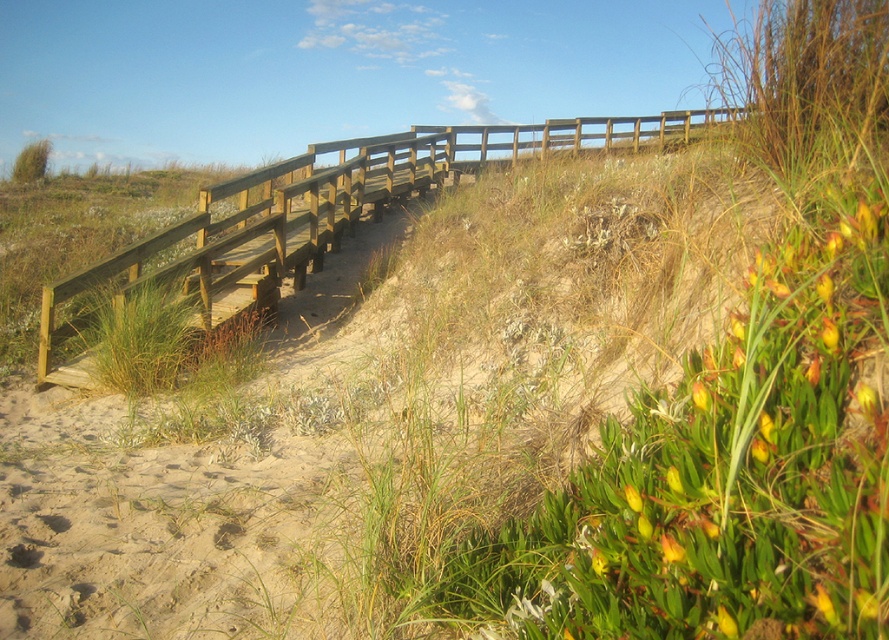
You are a hiker walking along the wooden rail at upper center and want to take a photo of the yellow matte flower at lower right. Is the flower visible through the rail?

The yellow matte flower at lower right is behind the wooden rail at upper center, so it might be obstructed by the rail and not fully visible.

From the picture: You are a photographer carrying a 1.2 meter wide camera setup. You need to position your equipment between the wooden rail at upper center and the yellow matte flower at lower right. Given their sizes, can you fit your setup without overlapping either object?

The wooden rail at upper center is larger in size than the yellow matte flower at lower right. Since the camera setup is 1.2 meters wide, you need to ensure there is enough space between them. However, without knowing the exact distance between the two objects, it is impossible to determine if the setup will fit without overlapping. Please check the actual spacing between the wooden rail at upper center and the yellow matte flower at lower right.

You are a park ranger checking the boardwalk and its surroundings. You notice the wooden rail at upper center and the yellow matte flower at lower right. Which object has a greater width?

The wooden rail at upper center has a greater width than the yellow matte flower at lower right.